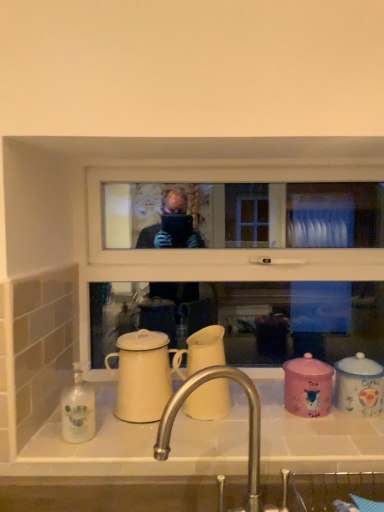
This screenshot has height=512, width=384. Find the location of `empty space that is to the right of white glossy bottle at lower left`. empty space that is to the right of white glossy bottle at lower left is located at coordinates (133, 439).